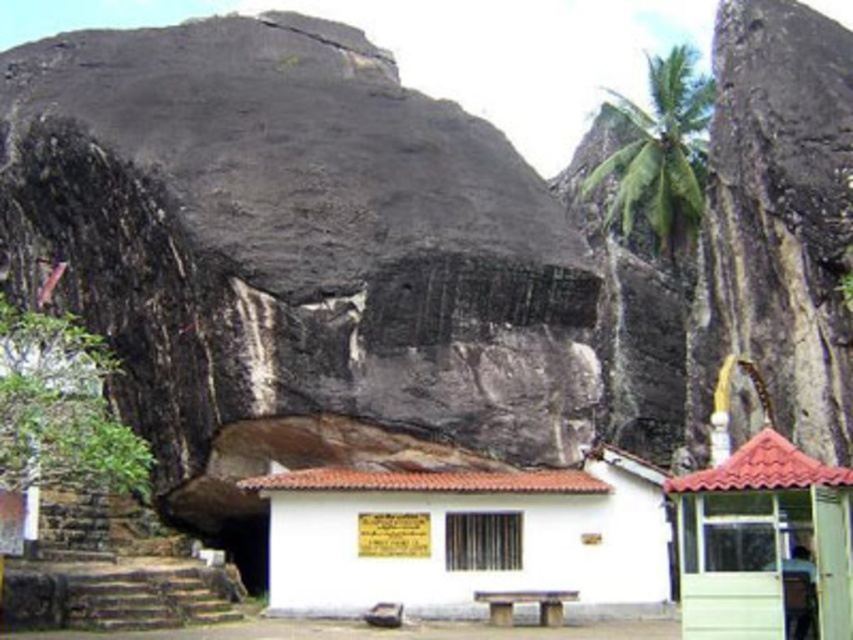
You are planning to set up a temporary shelter in this area. You have the option to choose between the white painted wood hut at center and the green plastic hut at lower right. Based on their sizes, which one would provide more space for your equipment?

The green plastic hut at lower right is larger in size compared to the white painted wood hut at center, so it would provide more space for equipment.

You are standing at point (467,538) in the image. What object are you standing on?

You are standing on the white painted wood hut at center located at point (467,538).

You are standing in front of the white painted wood hut at center and want to reach the green plastic hut at lower right. Which direction should you walk to get there?

The green plastic hut at lower right is behind the white painted wood hut at center, so you should walk backward to reach it.